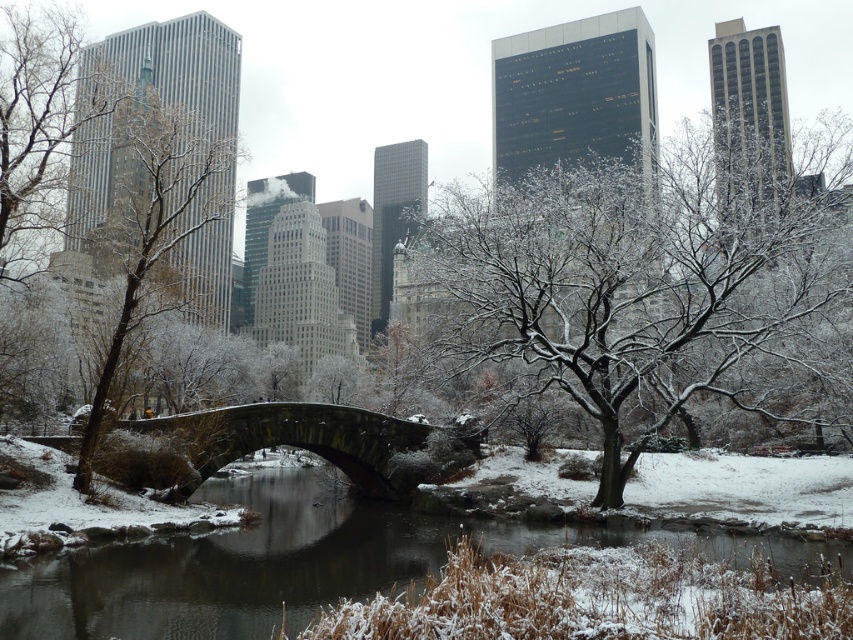
Does snow-covered branches at center have a lesser height compared to dark gray stone bridge at center?

No.

Is snow-covered branches at center to the left of dark gray stone bridge at center from the viewer's perspective?

No, snow-covered branches at center is not to the left of dark gray stone bridge at center.

The width and height of the screenshot is (853, 640). Identify the location of snow-covered branches at center. (645, 275).

Locate an element on the screen. This screenshot has width=853, height=640. snow-covered branches at center is located at coordinates (645, 275).

Can you confirm if snowy concrete bridge at center is positioned to the right of snow-covered bark tree at left?

Yes, snowy concrete bridge at center is to the right of snow-covered bark tree at left.

This screenshot has width=853, height=640. What do you see at coordinates (225, 566) in the screenshot? I see `snowy concrete bridge at center` at bounding box center [225, 566].

This screenshot has width=853, height=640. I want to click on snowy concrete bridge at center, so click(225, 566).

Consider the image. Is snow-covered branches at center taller than snow-covered bark tree at left?

Incorrect, snow-covered branches at center's height is not larger of snow-covered bark tree at left's.

Between point (573, 257) and point (132, 208), which one is positioned behind?

The point (132, 208) is more distant.

Does point (566, 348) come behind point (181, 157)?

That is False.

Where is `snow-covered branches at center`? snow-covered branches at center is located at coordinates (645, 275).